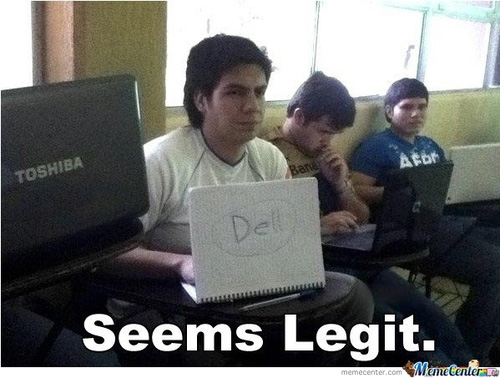
Where is `laptop`? This screenshot has width=500, height=378. laptop is located at coordinates (44, 200), (406, 230).